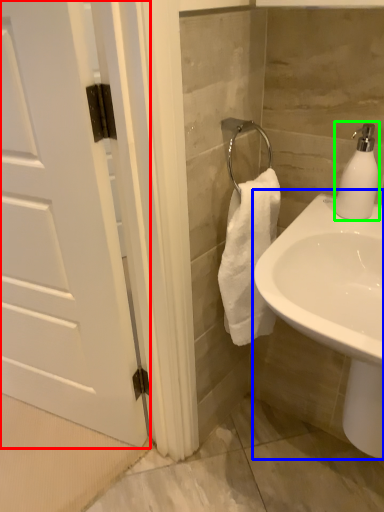
Question: Considering the real-world distances, which object is farthest from door (highlighted by a red box)? sink (highlighted by a blue box) or soap dispenser (highlighted by a green box)?

Choices:
 (A) sink
 (B) soap dispenser

Answer: (B)